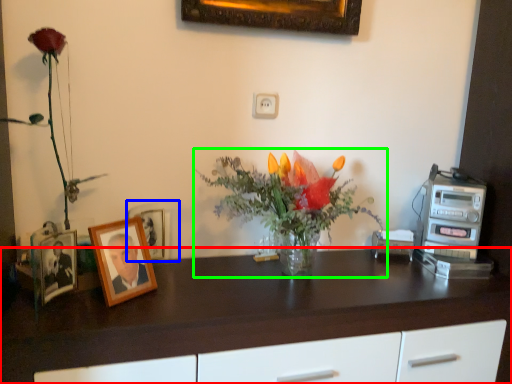
Question: Estimate the real-world distances between objects in this image. Which object is farther from desk (highlighted by a red box), picture frame (highlighted by a blue box) or houseplant (highlighted by a green box)?

Choices:
 (A) picture frame
 (B) houseplant

Answer: (A)